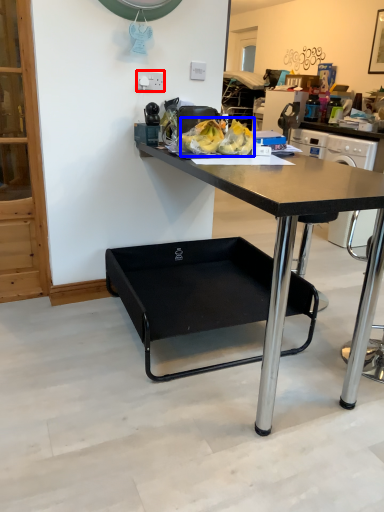
Question: Which object is further to the camera taking this photo, power outlet (highlighted by a red box) or food (highlighted by a blue box)?

Choices:
 (A) power outlet
 (B) food

Answer: (A)